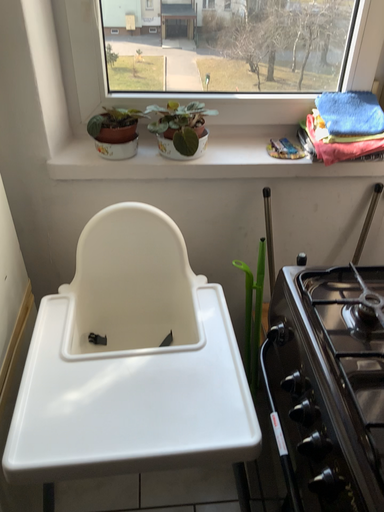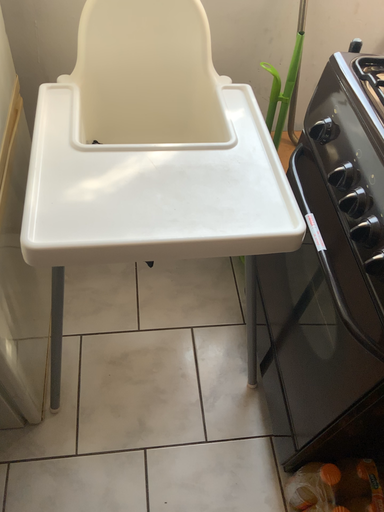
Question: How did the camera likely rotate when shooting the video?

Choices:
 (A) rotated upward
 (B) rotated downward

Answer: (B)